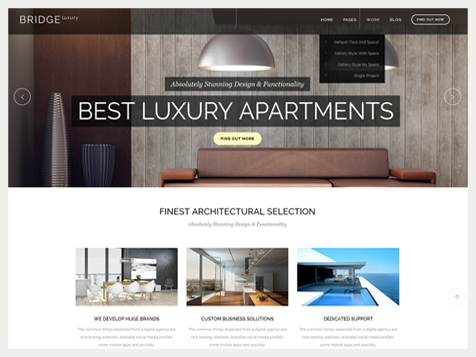
Locate the where you'd sit in the image. Your answer should be formatted as a list of tuples, i.e. [(x1, y1), (x2, y2), ...], where each tuple contains the x and y coordinates of a point satisfying the conditions above.

[(228, 179), (358, 180)]